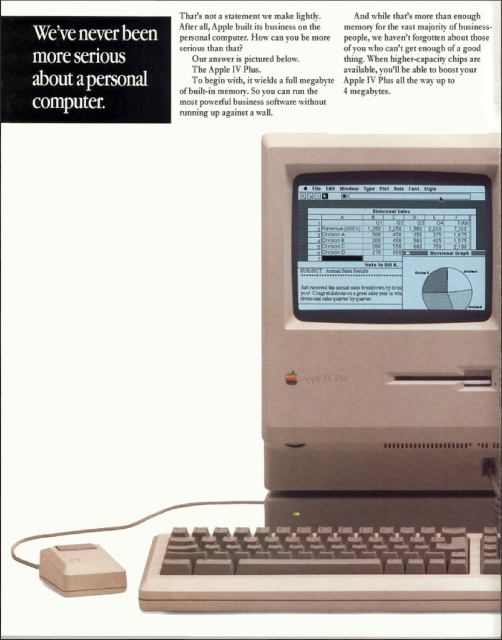
Between beige plastic apple iv plus at center and brown plastic keyboard at lower center, which one appears on the right side from the viewer's perspective?

beige plastic apple iv plus at center is more to the right.

Which is behind, point (222, 596) or point (294, 593)?

The point (294, 593) is behind.

In order to click on beige plastic apple iv plus at center in this screenshot , I will do `click(366, 376)`.

Is the position of matte plastic monitor at center more distant than that of beige plastic mouse at lower left?

Yes, it is.

Image resolution: width=502 pixels, height=640 pixels. What do you see at coordinates (391, 246) in the screenshot?
I see `matte plastic monitor at center` at bounding box center [391, 246].

The image size is (502, 640). Find the location of `matte plastic monitor at center`. matte plastic monitor at center is located at coordinates (391, 246).

Is beige plastic apple iv plus at center positioned behind beige plastic mouse at lower left?

No, beige plastic apple iv plus at center is in front of beige plastic mouse at lower left.

Who is taller, beige plastic apple iv plus at center or beige plastic mouse at lower left?

With more height is beige plastic apple iv plus at center.

Image resolution: width=502 pixels, height=640 pixels. What are the coordinates of `beige plastic apple iv plus at center` in the screenshot? It's located at 366,376.